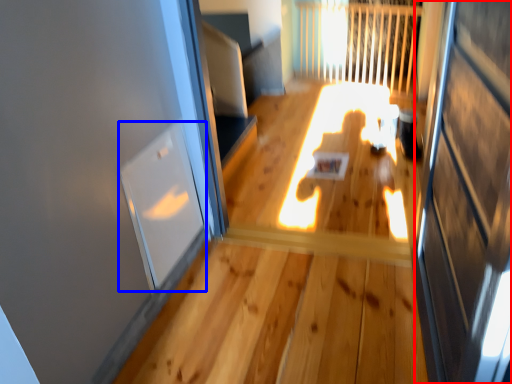
Question: Which point is further to the camera, screen door (highlighted by a red box) or window (highlighted by a blue box)?

Choices:
 (A) screen door
 (B) window

Answer: (B)